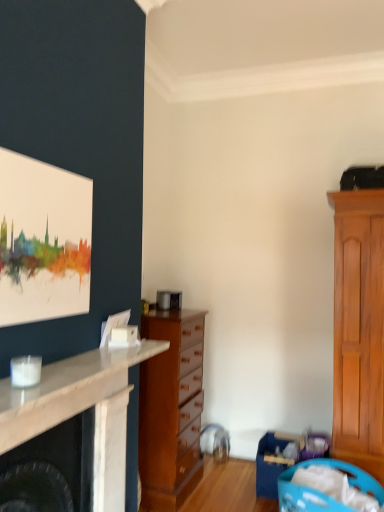
Question: Considering the positions of point coord(89,199) and point coord(256,450), is point coord(89,199) closer or farther from the camera than point coord(256,450)?

Choices:
 (A) closer
 (B) farther

Answer: (A)

Question: Based on their sizes in the image, would you say watercolor canvas at upper left is bigger or smaller than blue plastic laundry basket at lower right, the second laundry basket when ordered from front to back?

Choices:
 (A) small
 (B) big

Answer: (A)

Question: Which of these objects is positioned closest to the watercolor canvas at upper left?

Choices:
 (A) wooden chest of drawers at center
 (B) blue plastic laundry basket at lower right, the first laundry basket when ordered from back to front
 (C) blue plastic laundry basket at lower right, placed as the 1th laundry basket when sorted from front to back
 (D) white marble fireplace at left

Answer: (D)

Question: Which of these objects is positioned farthest from the watercolor canvas at upper left?

Choices:
 (A) blue plastic laundry basket at lower right, the first laundry basket when ordered from back to front
 (B) wooden chest of drawers at center
 (C) white marble fireplace at left
 (D) blue plastic laundry basket at lower right, the second laundry basket when ordered from back to front

Answer: (A)